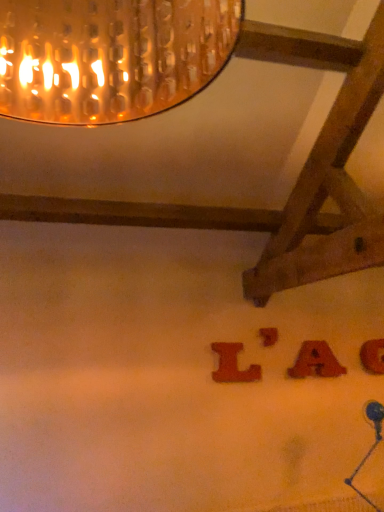
Locate an element on the screen. wooden letter l at center, which ranks as the 1th alphabet in left-to-right order is located at coordinates (233, 365).

In order to face wooden letter l at center, which ranks as the 1th alphabet in left-to-right order, should I rotate leftwards or rightwards?

Rotate your view right by about 5.843°.

Locate an element on the screen. The width and height of the screenshot is (384, 512). wooden letter at lower right, the 1th alphabet from the right is located at coordinates (373, 356).

Starting from the wooden letter l at center, which ranks as the 1th alphabet in left-to-right order, which alphabet is the 2nd one to the right? Please provide its 2D coordinates.

[(316, 361)]

Is wooden letter l at center, which ranks as the 1th alphabet in left-to-right order, completely or partially inside matte wooden letter a at lower right, the 2th alphabet when ordered from right to left?

No, matte wooden letter a at lower right, the 2th alphabet when ordered from right to left, does not contain wooden letter l at center, which ranks as the 1th alphabet in left-to-right order.

Can you confirm if matte wooden letter a at lower right, which is the third alphabet from left to right, is thinner than wooden letter l at center, which ranks as the 1th alphabet in left-to-right order?

No.

Considering the positions of points (242, 377) and (315, 350), is point (242, 377) closer to camera compared to point (315, 350)?

That is True.

There is a matte wooden letter a at lower right, which is the third alphabet from left to right. Where is `the 1st alphabet above it (from the image's perspective)`? The height and width of the screenshot is (512, 384). the 1st alphabet above it (from the image's perspective) is located at coordinates (233, 365).

Is wooden letter l at center, which ranks as the 1th alphabet in left-to-right order, in front of matte wooden letter a at lower right, the 2th alphabet when ordered from right to left?

Yes.

Which object is closer to the camera, wooden letter l at center, the 4th alphabet in the right-to-left sequence, or wooden letter at lower right, the 4th alphabet when ordered from left to right?

wooden letter l at center, the 4th alphabet in the right-to-left sequence, is more forward.

Which is more to the left, wooden letter l at center, which ranks as the 1th alphabet in left-to-right order, or wooden letter at lower right, the 1th alphabet from the right?

From the viewer's perspective, wooden letter l at center, which ranks as the 1th alphabet in left-to-right order, appears more on the left side.

From the image's perspective, is wooden letter l at center, which ranks as the 1th alphabet in left-to-right order, located above wooden letter at lower right, the 1th alphabet from the right?

Yes, from the image's perspective, wooden letter l at center, which ranks as the 1th alphabet in left-to-right order, is over wooden letter at lower right, the 1th alphabet from the right.

Which is behind, point (238, 370) or point (369, 350)?

Positioned behind is point (369, 350).

Can you tell me how much wooden letter at lower right, the 4th alphabet when ordered from left to right, and matte wooden letter a at lower right, the 2th alphabet when ordered from right to left, differ in facing direction?

The angle between the facing direction of wooden letter at lower right, the 4th alphabet when ordered from left to right, and the facing direction of matte wooden letter a at lower right, the 2th alphabet when ordered from right to left, is 0.00738 degrees.

Who is shorter, wooden letter at lower right, the 4th alphabet when ordered from left to right, or matte wooden letter a at lower right, the 2th alphabet when ordered from right to left?

matte wooden letter a at lower right, the 2th alphabet when ordered from right to left.

Which object is further away from the camera taking this photo, wooden letter at lower right, the 1th alphabet from the right, or matte wooden letter a at lower right, the 2th alphabet when ordered from right to left?

wooden letter at lower right, the 1th alphabet from the right, is further away from the camera.

Considering the relative sizes of wooden letter at center, which appears as the 2th alphabet when viewed from the left, and wooden letter at lower right, the 4th alphabet when ordered from left to right, in the image provided, is wooden letter at center, which appears as the 2th alphabet when viewed from the left, wider than wooden letter at lower right, the 4th alphabet when ordered from left to right,?

Incorrect, the width of wooden letter at center, which appears as the 2th alphabet when viewed from the left, does not surpass that of wooden letter at lower right, the 4th alphabet when ordered from left to right.

Is wooden letter at center, the 3th alphabet positioned from the right, surrounding wooden letter at lower right, the 4th alphabet when ordered from left to right?

No, wooden letter at lower right, the 4th alphabet when ordered from left to right, is not a part of wooden letter at center, the 3th alphabet positioned from the right.

Does wooden letter at center, which appears as the 2th alphabet when viewed from the left, appear on the right side of wooden letter at lower right, the 4th alphabet when ordered from left to right?

In fact, wooden letter at center, which appears as the 2th alphabet when viewed from the left, is to the left of wooden letter at lower right, the 4th alphabet when ordered from left to right.

Does wooden letter at center, which appears as the 2th alphabet when viewed from the left, turn towards wooden letter at lower right, the 1th alphabet from the right?

No, wooden letter at center, which appears as the 2th alphabet when viewed from the left, does not turn towards wooden letter at lower right, the 1th alphabet from the right.

Considering the sizes of objects wooden letter at lower right, the 4th alphabet when ordered from left to right, and wooden letter at center, which appears as the 2th alphabet when viewed from the left, in the image provided, who is shorter, wooden letter at lower right, the 4th alphabet when ordered from left to right, or wooden letter at center, which appears as the 2th alphabet when viewed from the left,?

With less height is wooden letter at center, which appears as the 2th alphabet when viewed from the left.

Could wooden letter at center, the 3th alphabet positioned from the right, be considered to be inside wooden letter at lower right, the 4th alphabet when ordered from left to right?

No, wooden letter at center, the 3th alphabet positioned from the right, is located outside of wooden letter at lower right, the 4th alphabet when ordered from left to right.

How different are the orientations of wooden letter at lower right, the 4th alphabet when ordered from left to right, and wooden letter at center, which appears as the 2th alphabet when viewed from the left, in degrees?

The angle between the facing direction of wooden letter at lower right, the 4th alphabet when ordered from left to right, and the facing direction of wooden letter at center, which appears as the 2th alphabet when viewed from the left, is 0.0128 degrees.

Is wooden letter at lower right, the 4th alphabet when ordered from left to right, closer to the viewer compared to wooden letter at center, the 3th alphabet positioned from the right?

No, wooden letter at lower right, the 4th alphabet when ordered from left to right, is further to the viewer.

Is wooden letter at lower right, the 4th alphabet when ordered from left to right, a part of matte wooden letter a at lower right, which is the third alphabet from left to right?

That's incorrect, wooden letter at lower right, the 4th alphabet when ordered from left to right, is not inside matte wooden letter a at lower right, which is the third alphabet from left to right.

Which object is positioned more to the right, matte wooden letter a at lower right, the 2th alphabet when ordered from right to left, or wooden letter at lower right, the 4th alphabet when ordered from left to right?

wooden letter at lower right, the 4th alphabet when ordered from left to right, is more to the right.

From the image's perspective, is matte wooden letter a at lower right, the 2th alphabet when ordered from right to left, beneath wooden letter at lower right, the 4th alphabet when ordered from left to right?

No, from the image's perspective, matte wooden letter a at lower right, the 2th alphabet when ordered from right to left, is not beneath wooden letter at lower right, the 4th alphabet when ordered from left to right.

From the image's perspective, count 1st alphabets upward from the matte wooden letter a at lower right, the 2th alphabet when ordered from right to left, and point to it. Please provide its 2D coordinates.

[(233, 365)]

You are a GUI agent. You are given a task and a screenshot of the screen. Output one action in this format:
    pyautogui.click(x=<x>, y=<y>)
    Task: Click on the 2nd alphabet counting from the left side of the matte wooden letter a at lower right, the 2th alphabet when ordered from right to left
    The width and height of the screenshot is (384, 512).
    Given the screenshot: What is the action you would take?
    pyautogui.click(x=233, y=365)

When comparing their distances from wooden letter l at center, which ranks as the 1th alphabet in left-to-right order, does wooden letter at lower right, the 1th alphabet from the right, or matte wooden letter a at lower right, which is the third alphabet from left to right, seem closer?

matte wooden letter a at lower right, which is the third alphabet from left to right.

When comparing their distances from wooden letter at lower right, the 4th alphabet when ordered from left to right, does matte wooden letter a at lower right, the 2th alphabet when ordered from right to left, or wooden letter l at center, the 4th alphabet in the right-to-left sequence, seem closer?

The object closer to wooden letter at lower right, the 4th alphabet when ordered from left to right, is matte wooden letter a at lower right, the 2th alphabet when ordered from right to left.

Considering their positions, is wooden letter at lower right, the 4th alphabet when ordered from left to right, positioned closer to wooden letter l at center, which ranks as the 1th alphabet in left-to-right order, than wooden letter at center, which appears as the 2th alphabet when viewed from the left?

The object closer to wooden letter l at center, which ranks as the 1th alphabet in left-to-right order, is wooden letter at center, which appears as the 2th alphabet when viewed from the left.

Looking at the image, which one is located closer to wooden letter at lower right, the 1th alphabet from the right, wooden letter l at center, which ranks as the 1th alphabet in left-to-right order, or wooden letter at center, the 3th alphabet positioned from the right?

Among the two, wooden letter at center, the 3th alphabet positioned from the right, is located nearer to wooden letter at lower right, the 1th alphabet from the right.

From the image, which object appears to be farther from wooden letter at center, which appears as the 2th alphabet when viewed from the left, wooden letter l at center, which ranks as the 1th alphabet in left-to-right order, or wooden letter at lower right, the 1th alphabet from the right?

The object further to wooden letter at center, which appears as the 2th alphabet when viewed from the left, is wooden letter at lower right, the 1th alphabet from the right.

Considering their positions, is wooden letter at lower right, the 4th alphabet when ordered from left to right, positioned further to matte wooden letter a at lower right, which is the third alphabet from left to right, than wooden letter at center, the 3th alphabet positioned from the right?

wooden letter at lower right, the 4th alphabet when ordered from left to right, is further to matte wooden letter a at lower right, which is the third alphabet from left to right.

Based on their spatial positions, is wooden letter at lower right, the 1th alphabet from the right, or matte wooden letter a at lower right, the 2th alphabet when ordered from right to left, further from wooden letter at center, which appears as the 2th alphabet when viewed from the left?

wooden letter at lower right, the 1th alphabet from the right, is positioned further to the anchor wooden letter at center, which appears as the 2th alphabet when viewed from the left.

Which object lies further to the anchor point wooden letter l at center, which ranks as the 1th alphabet in left-to-right order, matte wooden letter a at lower right, the 2th alphabet when ordered from right to left, or wooden letter at center, the 3th alphabet positioned from the right?

Among the two, matte wooden letter a at lower right, the 2th alphabet when ordered from right to left, is located further to wooden letter l at center, which ranks as the 1th alphabet in left-to-right order.

The image size is (384, 512). In order to click on alphabet between wooden letter at center, the 3th alphabet positioned from the right, and wooden letter at lower right, the 1th alphabet from the right in this screenshot , I will do `click(316, 361)`.

Find the location of a particular element. alphabet between wooden letter l at center, which ranks as the 1th alphabet in left-to-right order, and matte wooden letter a at lower right, the 2th alphabet when ordered from right to left, in the horizontal direction is located at coordinates (268, 336).